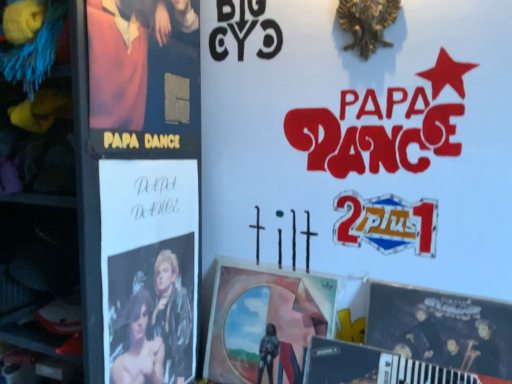
You are a GUI agent. You are given a task and a screenshot of the screen. Output one action in this format:
    pyautogui.click(x=<x>, y=<y>)
    Task: Click on the black glossy poster at left, placed as the 1th poster when sorted from left to right
    This screenshot has width=512, height=384.
    Given the screenshot: What is the action you would take?
    (x=149, y=269)

The image size is (512, 384). Describe the element at coordinates (372, 366) in the screenshot. I see `metallic silver magazine at lower right` at that location.

Image resolution: width=512 pixels, height=384 pixels. What do you see at coordinates (265, 323) in the screenshot?
I see `matte paper poster at center, the second poster positioned from the left` at bounding box center [265, 323].

Locate an element on the screen. matte black poster at lower right, which is the third poster from left to right is located at coordinates (442, 328).

From a real-world perspective, relative to metallic silver magazine at lower right, is matte paper poster at center, the second poster positioned from the left, vertically above or below?

matte paper poster at center, the second poster positioned from the left, is situated higher than metallic silver magazine at lower right in the real world.

Which is in front, point (216, 296) or point (401, 378)?

The point (401, 378) is more forward.

Is matte paper poster at center, the 2th poster in the right-to-left sequence, situated inside metallic silver magazine at lower right or outside?

matte paper poster at center, the 2th poster in the right-to-left sequence, cannot be found inside metallic silver magazine at lower right.

Between matte paper poster at center, the second poster positioned from the left, and metallic silver magazine at lower right, which one has more height?

matte paper poster at center, the second poster positioned from the left.

From the image's perspective, which is above, matte black poster at lower right, which is the third poster from left to right, or matte pink fabric at left?

matte pink fabric at left, from the image's perspective.

Is matte black poster at lower right, which is the third poster from left to right, turned away from matte pink fabric at left?

matte black poster at lower right, which is the third poster from left to right, is not turned away from matte pink fabric at left.

How different are the orientations of matte black poster at lower right, which ranks as the first poster in right-to-left order, and matte pink fabric at left in degrees?

The angle between the facing direction of matte black poster at lower right, which ranks as the first poster in right-to-left order, and the facing direction of matte pink fabric at left is 90 degrees.

Could matte pink fabric at left be considered to be inside matte black poster at lower right, which ranks as the first poster in right-to-left order?

No, matte pink fabric at left is not inside matte black poster at lower right, which ranks as the first poster in right-to-left order.

Can you confirm if matte black poster at lower right, which is the third poster from left to right, is positioned to the left of metallic silver magazine at lower right?

No, matte black poster at lower right, which is the third poster from left to right, is not to the left of metallic silver magazine at lower right.

Is matte black poster at lower right, which is the third poster from left to right, oriented towards metallic silver magazine at lower right?

Yes, matte black poster at lower right, which is the third poster from left to right, is oriented towards metallic silver magazine at lower right.

Is matte paper poster at center, the second poster positioned from the left, looking in the opposite direction of black glossy poster at left, placed as the 1th poster when sorted from left to right?

That's not correct — matte paper poster at center, the second poster positioned from the left, is not looking away from black glossy poster at left, placed as the 1th poster when sorted from left to right.

From a real-world perspective, is matte paper poster at center, the second poster positioned from the left, physically located above or below black glossy poster at left, arranged as the third poster when viewed from the right?

matte paper poster at center, the second poster positioned from the left, is situated lower than black glossy poster at left, arranged as the third poster when viewed from the right, in the real world.

Is matte paper poster at center, the second poster positioned from the left, located outside black glossy poster at left, arranged as the third poster when viewed from the right?

Yes, matte paper poster at center, the second poster positioned from the left, is not within black glossy poster at left, arranged as the third poster when viewed from the right.

Considering the relative sizes of matte paper poster at center, the second poster positioned from the left, and black glossy poster at left, placed as the 1th poster when sorted from left to right, in the image provided, is matte paper poster at center, the second poster positioned from the left, thinner than black glossy poster at left, placed as the 1th poster when sorted from left to right,?

No.

From the image's perspective, is black glossy poster at left, arranged as the third poster when viewed from the right, above or below matte pink fabric at left?

black glossy poster at left, arranged as the third poster when viewed from the right, is situated lower than matte pink fabric at left in the image.

Is point (151, 368) positioned behind point (189, 95)?

No, (151, 368) is in front of (189, 95).

Considering the sizes of objects black glossy poster at left, placed as the 1th poster when sorted from left to right, and matte pink fabric at left in the image provided, who is smaller, black glossy poster at left, placed as the 1th poster when sorted from left to right, or matte pink fabric at left?

With smaller size is black glossy poster at left, placed as the 1th poster when sorted from left to right.

Can you tell me how much matte paper poster at center, the second poster positioned from the left, and matte black poster at lower right, which is the third poster from left to right, differ in facing direction?

The angular difference between matte paper poster at center, the second poster positioned from the left, and matte black poster at lower right, which is the third poster from left to right, is 0.000654 degrees.

Would you say matte paper poster at center, the 2th poster in the right-to-left sequence, contains matte black poster at lower right, which ranks as the first poster in right-to-left order?

No, matte black poster at lower right, which ranks as the first poster in right-to-left order, is not inside matte paper poster at center, the 2th poster in the right-to-left sequence.

Based on the photo, would you consider matte paper poster at center, the 2th poster in the right-to-left sequence, to be distant from matte black poster at lower right, which is the third poster from left to right?

matte paper poster at center, the 2th poster in the right-to-left sequence, is near matte black poster at lower right, which is the third poster from left to right, not far away.

Relative to matte black poster at lower right, which ranks as the first poster in right-to-left order, is matte paper poster at center, the 2th poster in the right-to-left sequence, in front or behind?

matte paper poster at center, the 2th poster in the right-to-left sequence, is positioned farther from the viewer than matte black poster at lower right, which ranks as the first poster in right-to-left order.

Is the position of matte pink fabric at left more distant than that of matte black poster at lower right, which ranks as the first poster in right-to-left order?

No.

In the scene shown: Who is bigger, matte pink fabric at left or matte black poster at lower right, which is the third poster from left to right?

With larger size is matte black poster at lower right, which is the third poster from left to right.

From a real-world perspective, is matte pink fabric at left under matte black poster at lower right, which ranks as the first poster in right-to-left order?

Incorrect, from a real-world perspective, matte pink fabric at left is higher than matte black poster at lower right, which ranks as the first poster in right-to-left order.

Is matte pink fabric at left facing away from matte black poster at lower right, which ranks as the first poster in right-to-left order?

That's not correct — matte pink fabric at left is not looking away from matte black poster at lower right, which ranks as the first poster in right-to-left order.

Which poster is the 1st one when counting from the left side of the metallic silver magazine at lower right? Please provide its 2D coordinates.

[(265, 323)]

Image resolution: width=512 pixels, height=384 pixels. Find the location of `person above the matte black poster at lower right, which is the third poster from left to right (from a real-world perspective)`. person above the matte black poster at lower right, which is the third poster from left to right (from a real-world perspective) is located at coordinates (144, 65).

When comparing their distances from metallic silver magazine at lower right, does matte pink fabric at left or matte paper poster at center, the second poster positioned from the left, seem further?

matte pink fabric at left lies further to metallic silver magazine at lower right than the other object.

Estimate the real-world distances between objects in this image. Which object is further from matte black poster at lower right, which ranks as the first poster in right-to-left order, metallic silver magazine at lower right or matte paper poster at center, the second poster positioned from the left?

matte paper poster at center, the second poster positioned from the left, is further to matte black poster at lower right, which ranks as the first poster in right-to-left order.

In the scene shown: From the image, which object appears to be nearer to matte pink fabric at left, matte black poster at lower right, which ranks as the first poster in right-to-left order, or black glossy poster at left, placed as the 1th poster when sorted from left to right?

The object closer to matte pink fabric at left is black glossy poster at left, placed as the 1th poster when sorted from left to right.

Based on their spatial positions, is black glossy poster at left, arranged as the third poster when viewed from the right, or matte black poster at lower right, which is the third poster from left to right, further from matte paper poster at center, the second poster positioned from the left?

matte black poster at lower right, which is the third poster from left to right.

Considering their positions, is matte pink fabric at left positioned further to metallic silver magazine at lower right than black glossy poster at left, arranged as the third poster when viewed from the right?

Based on the image, matte pink fabric at left appears to be further to metallic silver magazine at lower right.

From the image, which object appears to be farther from black glossy poster at left, placed as the 1th poster when sorted from left to right, matte black poster at lower right, which ranks as the first poster in right-to-left order, or metallic silver magazine at lower right?

matte black poster at lower right, which ranks as the first poster in right-to-left order, lies further to black glossy poster at left, placed as the 1th poster when sorted from left to right, than the other object.

Looking at the image, which one is located further to matte paper poster at center, the 2th poster in the right-to-left sequence, black glossy poster at left, placed as the 1th poster when sorted from left to right, or metallic silver magazine at lower right?

black glossy poster at left, placed as the 1th poster when sorted from left to right, is further to matte paper poster at center, the 2th poster in the right-to-left sequence.

Looking at the image, which one is located further to matte black poster at lower right, which is the third poster from left to right, matte pink fabric at left or metallic silver magazine at lower right?

Based on the image, matte pink fabric at left appears to be further to matte black poster at lower right, which is the third poster from left to right.

This screenshot has height=384, width=512. Find the location of `poster situated between black glossy poster at left, arranged as the third poster when viewed from the right, and metallic silver magazine at lower right from left to right`. poster situated between black glossy poster at left, arranged as the third poster when viewed from the right, and metallic silver magazine at lower right from left to right is located at coordinates (265, 323).

In order to click on magazine located between matte paper poster at center, the second poster positioned from the left, and matte black poster at lower right, which ranks as the first poster in right-to-left order, in the left-right direction in this screenshot , I will do `click(372, 366)`.

What are the coordinates of `magazine situated between black glossy poster at left, arranged as the third poster when viewed from the right, and matte black poster at lower right, which is the third poster from left to right, from left to right` in the screenshot? It's located at (372, 366).

Locate an element on the screen. This screenshot has width=512, height=384. poster between matte pink fabric at left and matte black poster at lower right, which ranks as the first poster in right-to-left order, from top to bottom is located at coordinates pos(149,269).